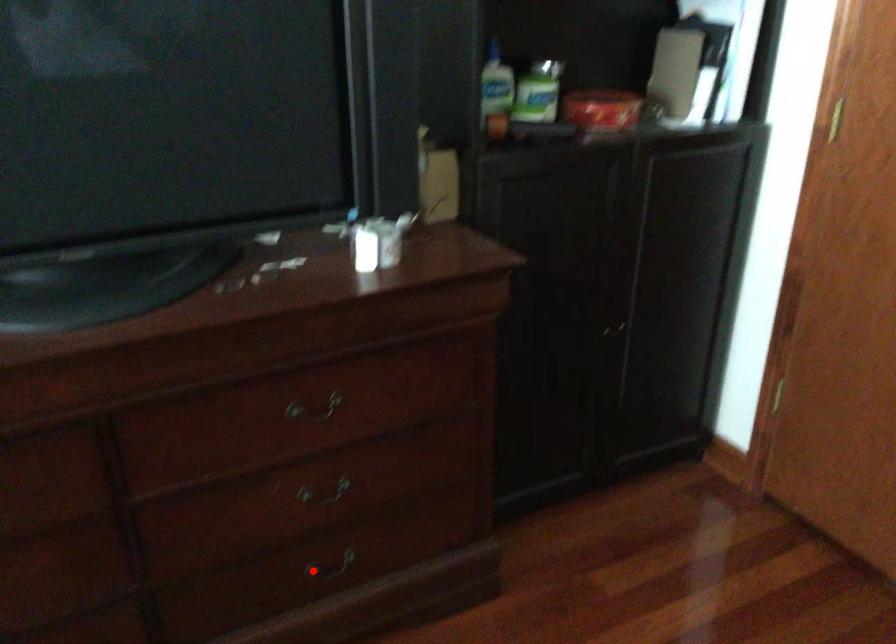
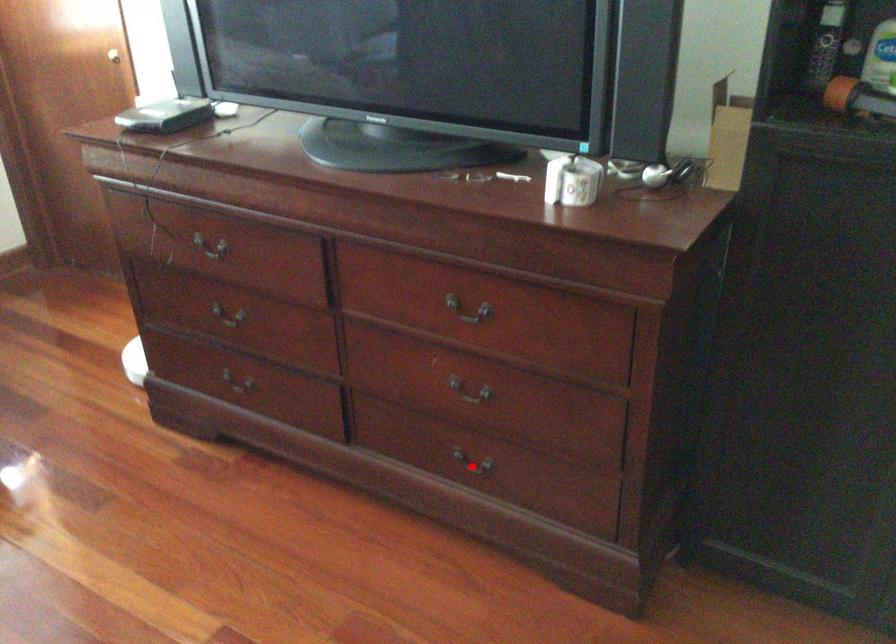
I am providing you with two images of the same scene from different viewpoints. A red point is marked on the first image and another point is marked on the second image. Is the marked point in image1 the same physical position as the marked point in image2?

Yes